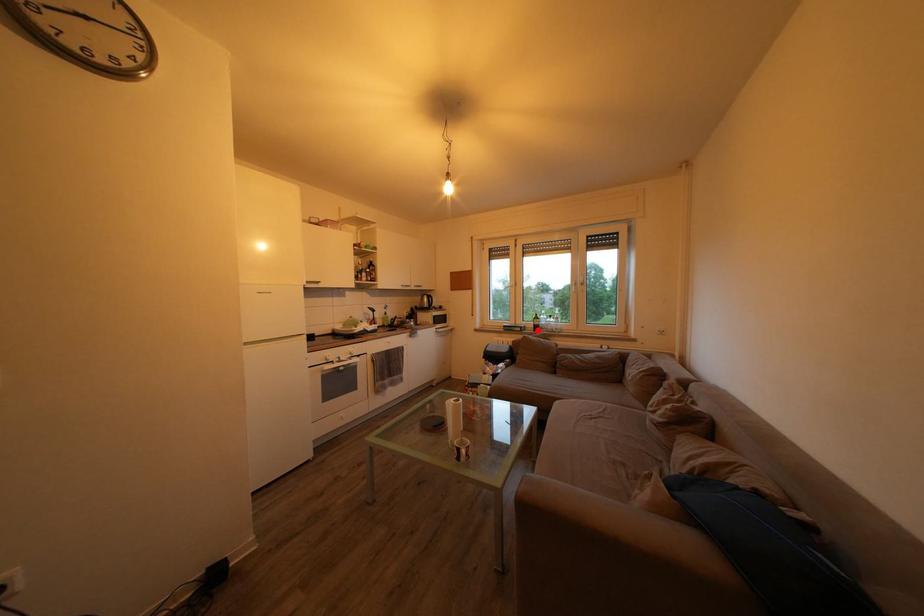
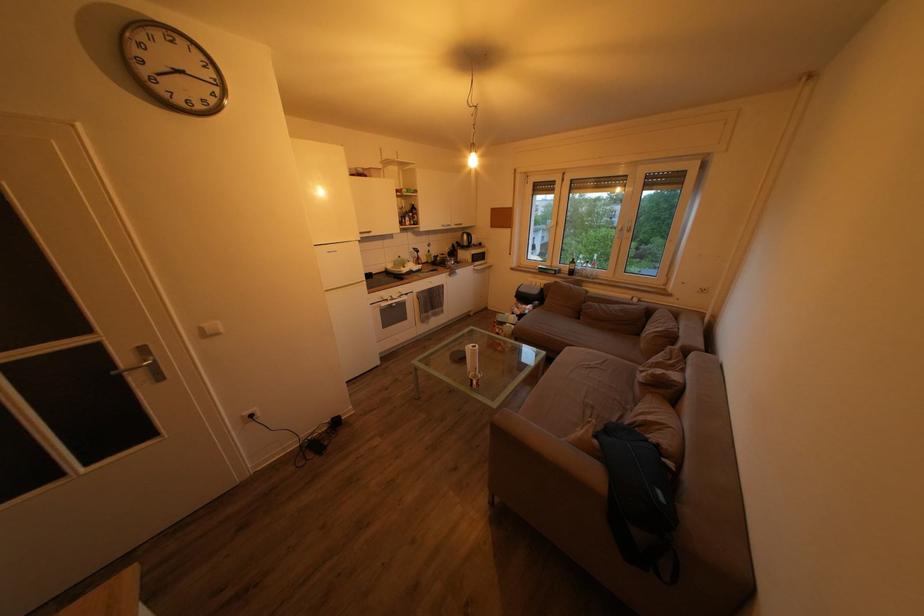
Question: I am providing you with two images of the same scene from different viewpoints. A red point is shown in image1. For the corresponding object point in image2, is it positioned nearer or farther from the camera?

Choices:
 (A) Nearer
 (B) Farther

Answer: (A)